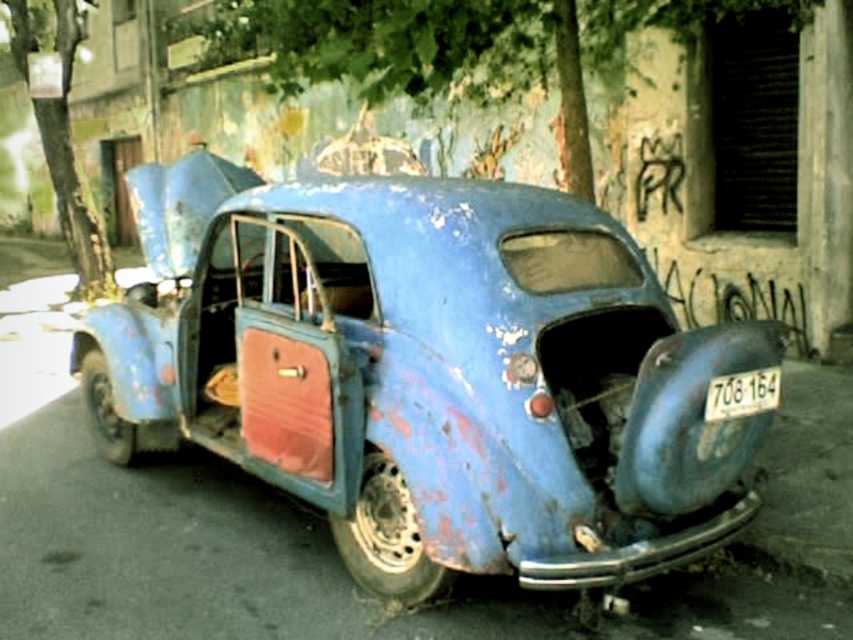
Question: Which is farther from the green leafy tree at upper left?

Choices:
 (A) white plastic license plate at center
 (B) green leafy tree at upper center
 (C) rusty blue car at center

Answer: (A)

Question: Estimate the real-world distances between objects in this image. Which object is farther from the green leafy tree at upper left?

Choices:
 (A) green leafy tree at upper center
 (B) white plastic license plate at center

Answer: (B)

Question: Is rusty blue car at center to the right of white plastic license plate at center from the viewer's perspective?

Choices:
 (A) yes
 (B) no

Answer: (B)

Question: Which of the following is the closest to the observer?

Choices:
 (A) (434, 204)
 (B) (750, 392)
 (C) (218, 52)
 (D) (73, 3)

Answer: (B)

Question: Does rusty blue car at center appear under green leafy tree at upper left?

Choices:
 (A) no
 (B) yes

Answer: (B)

Question: Where is rusty blue car at center located in relation to white plastic license plate at center in the image?

Choices:
 (A) below
 (B) above

Answer: (B)